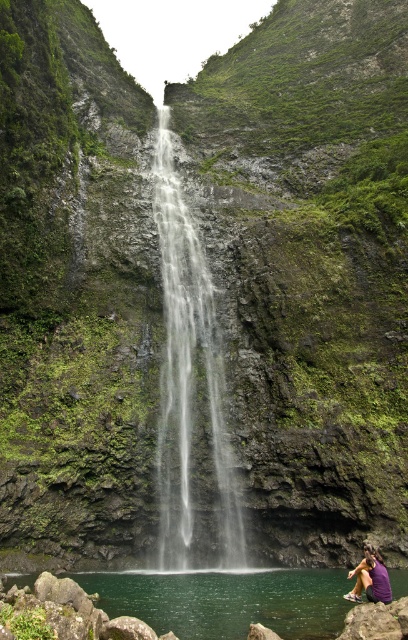
You are standing at the edge of the waterfall and want to place a small decorative rock between the green liquid water at lower center and the purple fabric at lower right. Based on their positions, which object should you place the rock closer to?

The green liquid water at lower center is closer to the viewer than the purple fabric at lower right, so you should place the rock closer to the purple fabric at lower right to ensure it is between both objects.

Consider the image. You are standing at the edge of the cliff overlooking the waterfall. You want to take a photo of the clear water at center. Where should you aim your camera to capture it?

You should aim your camera at point (188, 381) to capture the clear water at center.